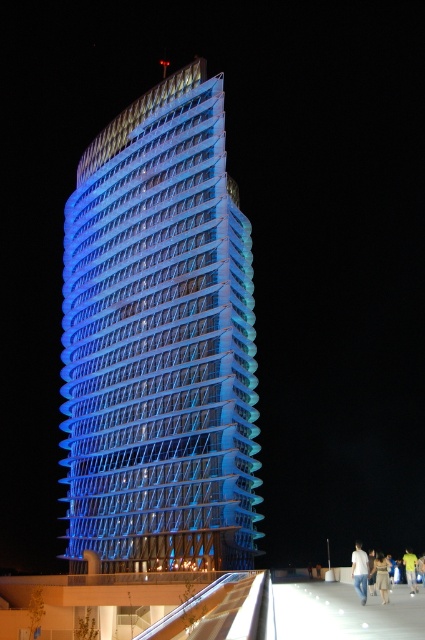
You are standing on the walkway near the white cotton shirt at lower right and want to take a photo of the blue glass tower at center. Which direction should you look to capture the tower in your camera?

The blue glass tower at center is above the white cotton shirt at lower right, so you should look upwards to capture the tower in your camera.

You are standing on the walkway in front of the blue glass tower at center. You want to take a photo of the tower with your smartphone, which has a maximum zoom capability of 10x. Considering the distance, can you clearly see the horizontal bands on the tower in your photo?

The blue glass tower at center is 62.97 meters away. Since smartphones typically have limited zoom capabilities, even at 10x zoom, capturing fine details like the horizontal bands from this distance may be challenging. It might be difficult to clearly see the bands in the photo.